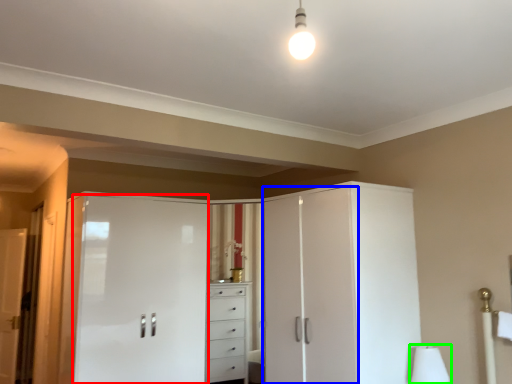
Question: Which is farther away from screen door (highlighted by a red box)? screen door (highlighted by a blue box) or table lamp (highlighted by a green box)?

Choices:
 (A) screen door
 (B) table lamp

Answer: (B)